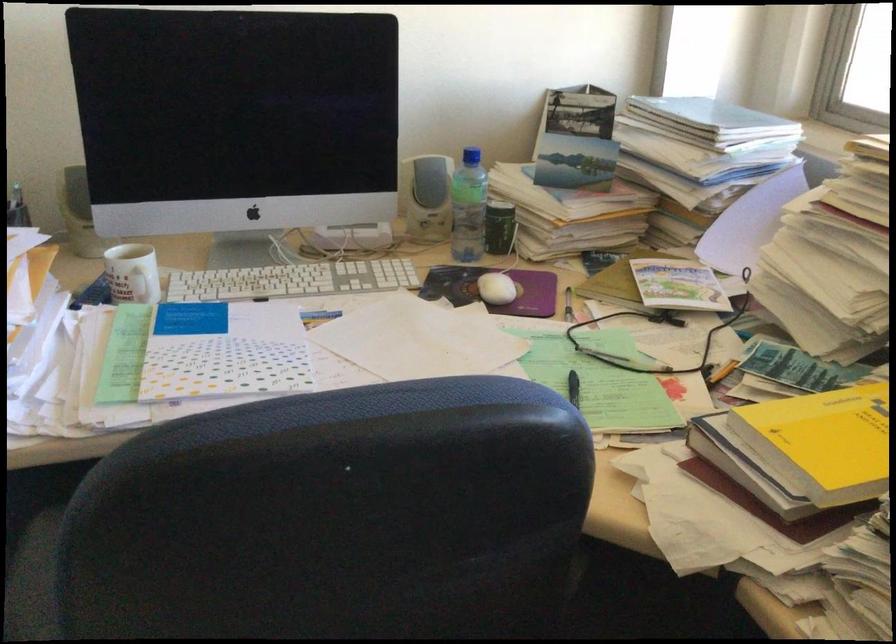
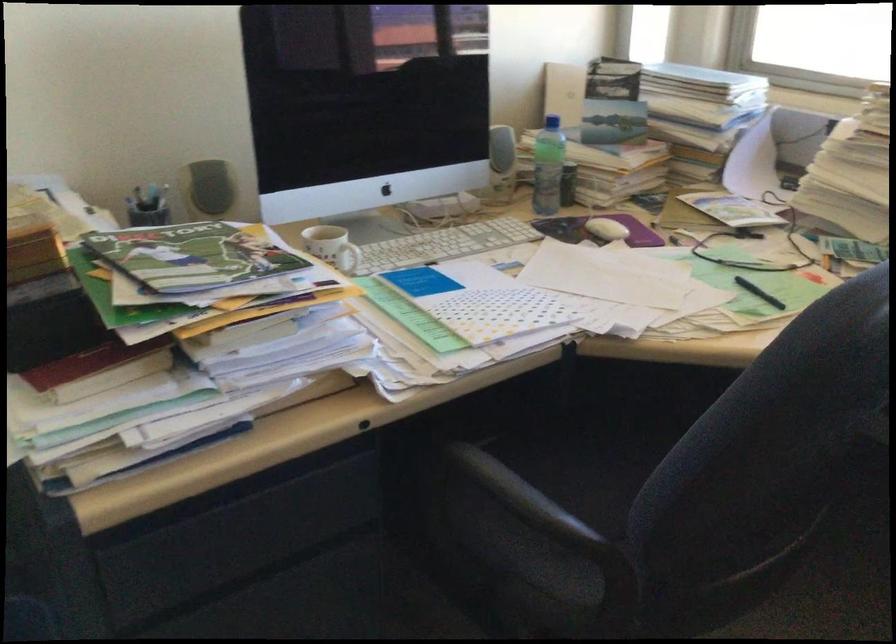
Question: Which direction would the cameraman need to move to produce the second image? Reply with the corresponding letter.

Choices:
 (A) Left
 (B) Right
 (C) Forward
 (D) Backward

Answer: (A)